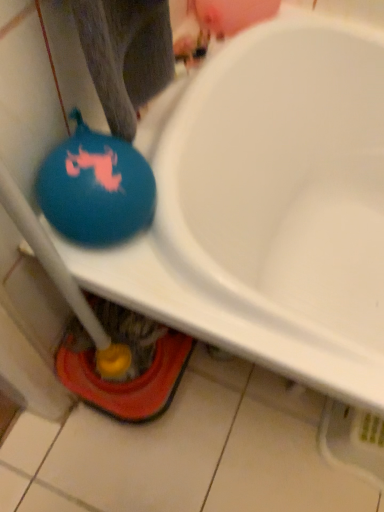
The image size is (384, 512). In order to click on vacant space to the right of blue rubber balloon at left in this screenshot , I will do `click(202, 278)`.